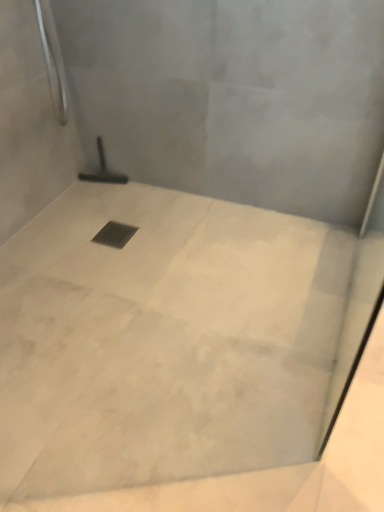
Question: Is black metal drain at center inside or outside of black rubber squeegee at center?

Choices:
 (A) outside
 (B) inside

Answer: (A)

Question: Considering the positions of black metal drain at center and black rubber squeegee at center in the image, is black metal drain at center bigger or smaller than black rubber squeegee at center?

Choices:
 (A) small
 (B) big

Answer: (A)

Question: Which object is positioned farthest from the black metal drain at center?

Choices:
 (A) white marble floor at center
 (B) black rubber squeegee at center

Answer: (A)

Question: Which is farther from the white marble floor at center?

Choices:
 (A) black metal drain at center
 (B) black rubber squeegee at center

Answer: (B)